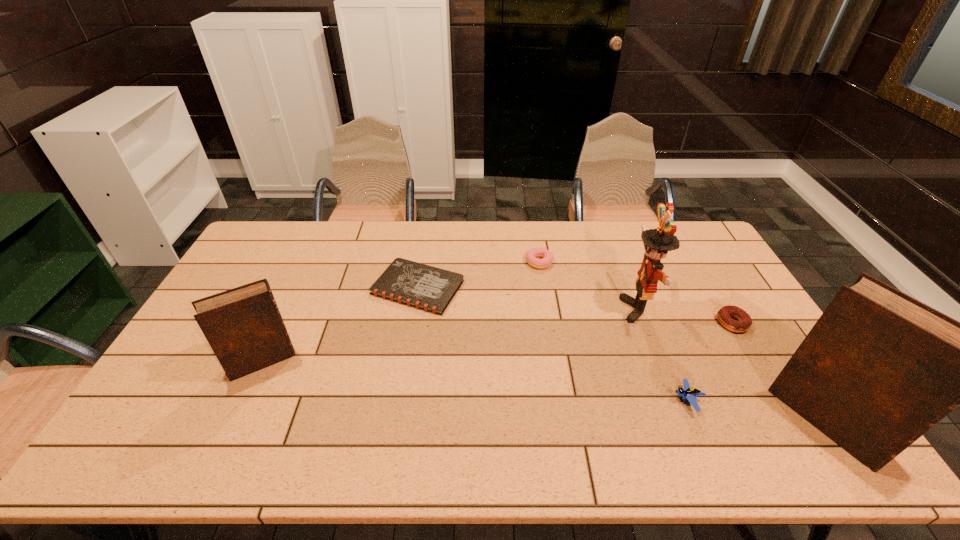
Find the location of `free location located 0.350m on the front-facing side of the fourth tallest object`. free location located 0.350m on the front-facing side of the fourth tallest object is located at coordinates (537, 401).

Find the location of a particular element. object located in the far edge section of the desktop is located at coordinates (547, 257).

Identify the location of Bible that is at the near edge. (879, 368).

Where is `Lego that is at the near edge`? Image resolution: width=960 pixels, height=540 pixels. Lego that is at the near edge is located at coordinates (689, 392).

This screenshot has width=960, height=540. I want to click on object that is positioned at the left edge, so click(x=244, y=327).

This screenshot has width=960, height=540. In order to click on Bible at the right edge in this screenshot , I will do `click(879, 368)`.

Where is `doughnut present at the right edge`? doughnut present at the right edge is located at coordinates (724, 315).

The image size is (960, 540). I want to click on object that is at the near right corner, so click(879, 368).

The width and height of the screenshot is (960, 540). Identify the location of free space at the far edge of the desktop. (458, 245).

Where is `vacant space at the near edge`? This screenshot has height=540, width=960. vacant space at the near edge is located at coordinates (318, 402).